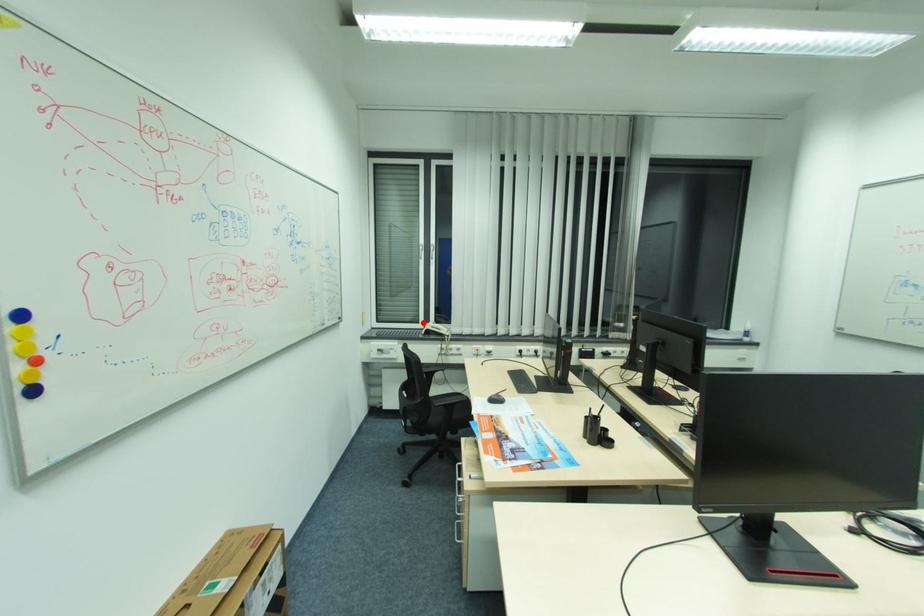
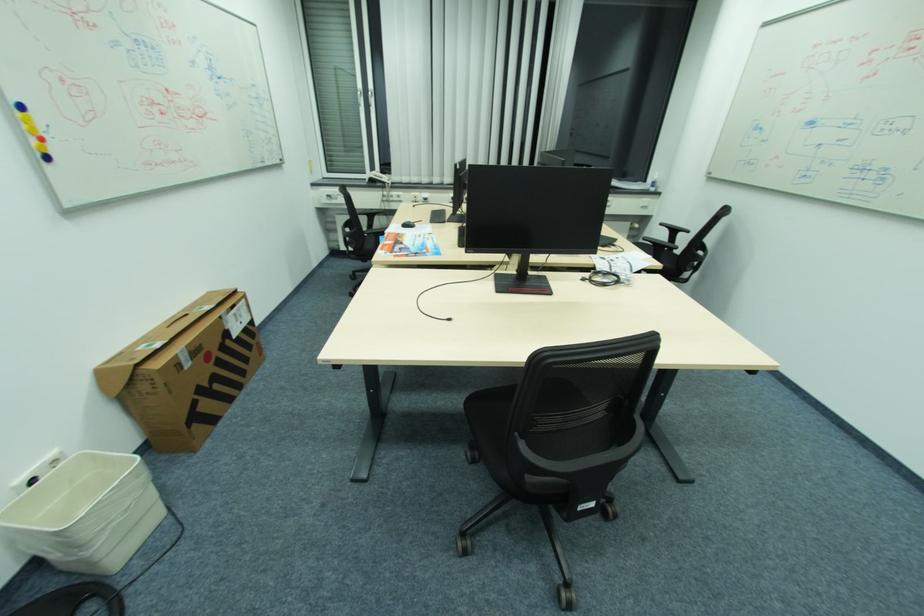
Question: A red point is marked in image1. In image2, is the corresponding 3D point closer to the camera or farther? Reply with the corresponding letter.

Choices:
 (A) The corresponding 3D point is closer.
 (B) The corresponding 3D point is farther.

Answer: (A)